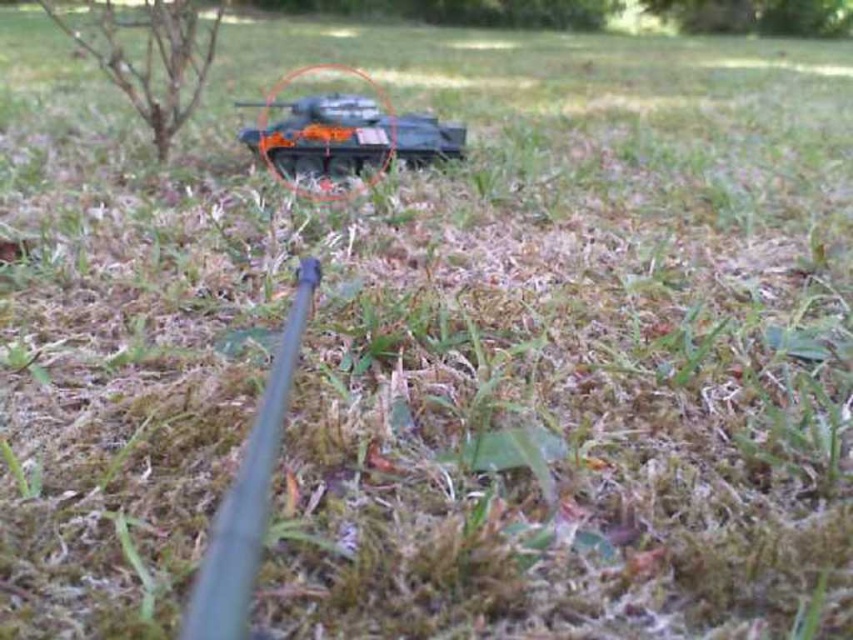
Question: Does metallic gray gun at center have a larger size compared to brown rough tree at upper left?

Choices:
 (A) yes
 (B) no

Answer: (B)

Question: Based on their relative distances, which object is nearer to the orange matte tank at center?

Choices:
 (A) metallic gray gun at center
 (B) brown rough tree at upper left

Answer: (B)

Question: In this image, where is metallic gray gun at center located relative to brown rough tree at upper left?

Choices:
 (A) right
 (B) left

Answer: (A)

Question: Can you confirm if orange matte tank at center is positioned to the right of brown rough tree at upper left?

Choices:
 (A) yes
 (B) no

Answer: (A)

Question: Which of the following is the closest to the observer?

Choices:
 (A) metallic gray gun at center
 (B) orange matte tank at center
 (C) brown rough tree at upper left

Answer: (A)

Question: Which object is positioned farthest from the orange matte tank at center?

Choices:
 (A) brown rough tree at upper left
 (B) metallic gray gun at center

Answer: (B)